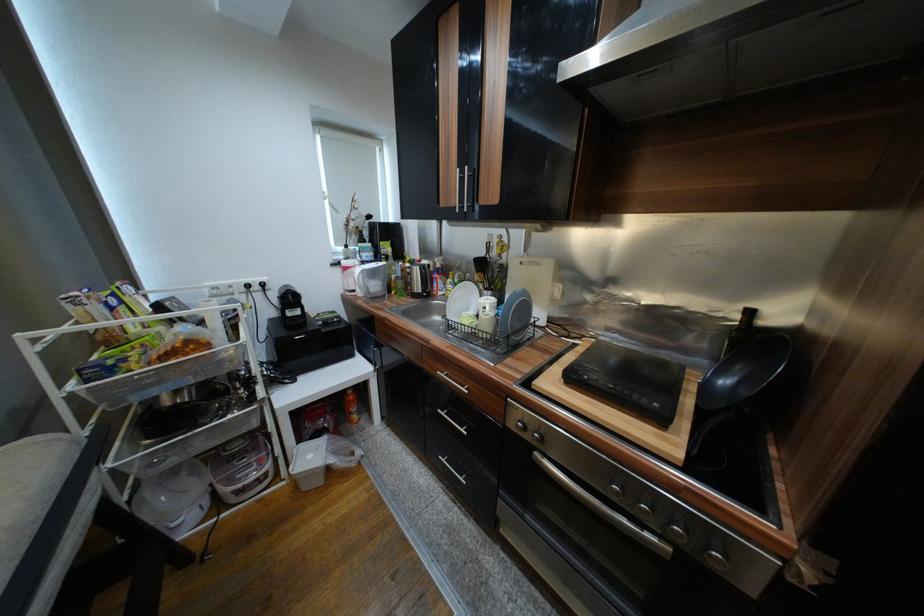
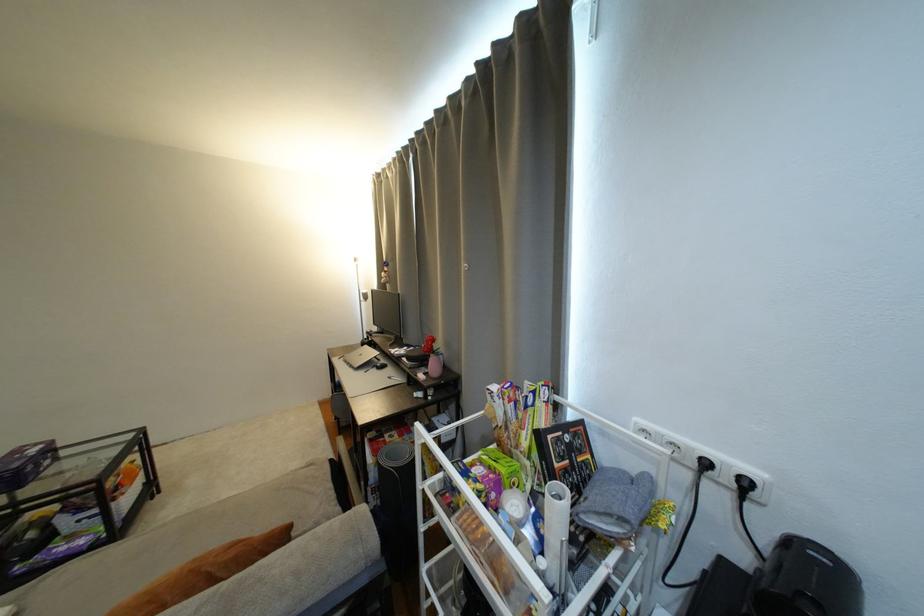
Find the pixel in the second image that matches the point at 257,286 in the first image.

(714, 466)